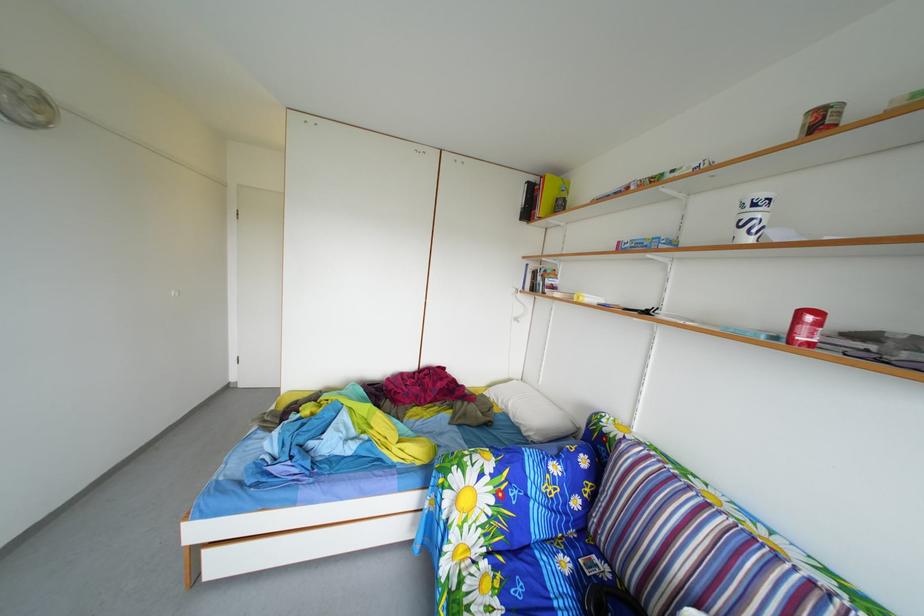
Locate an element on the screen. The image size is (924, 616). white wall dial is located at coordinates (26, 103).